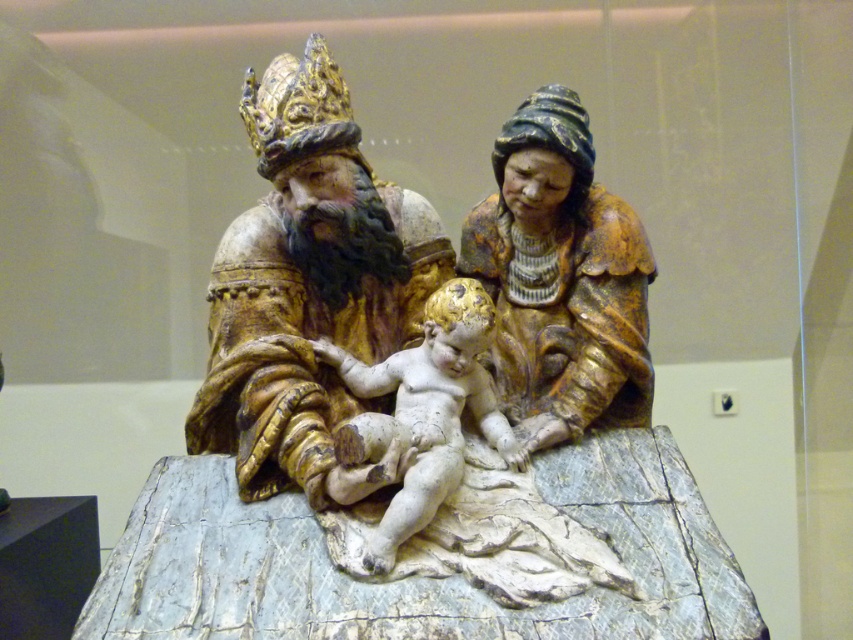
Question: Considering the relative positions of gold-painted wood figure at center-left and white matte baby at center in the image provided, where is gold-painted wood figure at center-left located with respect to white matte baby at center?

Choices:
 (A) left
 (B) right

Answer: (A)

Question: Which point is farther to the camera?

Choices:
 (A) (421, 292)
 (B) (479, 397)
 (C) (606, 368)
 (D) (445, 380)

Answer: (A)

Question: Can you confirm if gold-painted wood sculpture of the holy family at center is smaller than gold-painted wood figure at center-left?

Choices:
 (A) yes
 (B) no

Answer: (A)

Question: Based on their relative distances, which object is farther from the white matte baby at center?

Choices:
 (A) gold-painted wood sculpture of the holy family at center
 (B) matte gold statue at center
 (C) gold-painted wood figure at center-left

Answer: (A)

Question: Where is matte gold statue at center located in relation to white matte baby at center in the image?

Choices:
 (A) above
 (B) below

Answer: (A)

Question: Which of these objects is positioned closest to the matte gold statue at center?

Choices:
 (A) white matte baby at center
 (B) gold-painted wood figure at center-left

Answer: (A)